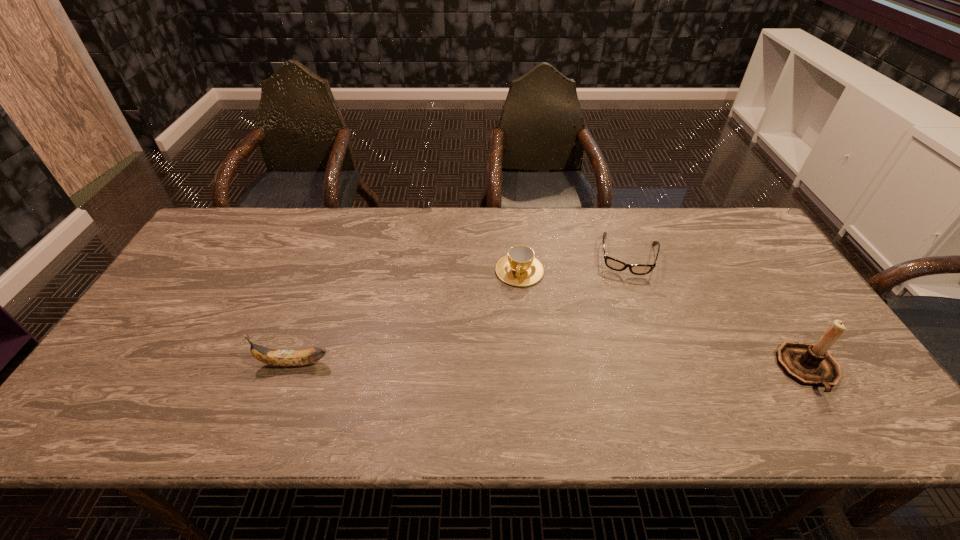
The width and height of the screenshot is (960, 540). Identify the location of the second tallest object. (285, 358).

Locate an element on the screen. banana is located at coordinates (285, 358).

At what (x,y) coordinates should I click in order to perform the action: click on the tallest object. Please return your answer as a coordinate pair (x, y). Looking at the image, I should click on (809, 364).

Identify the location of candle holder. (809, 364).

This screenshot has width=960, height=540. In order to click on the shortest object in this screenshot , I will do `click(637, 269)`.

Identify the location of spectacles. (637, 269).

The width and height of the screenshot is (960, 540). What are the coordinates of `the third object from right to left` in the screenshot? It's located at (519, 267).

The image size is (960, 540). Find the location of `the third tallest object`. the third tallest object is located at coordinates (x=519, y=267).

What are the coordinates of `vacant space positioned on the peel of the second tallest object` in the screenshot? It's located at (112, 363).

This screenshot has width=960, height=540. Identify the location of blank space located 0.190m on the peel of the second tallest object. (179, 363).